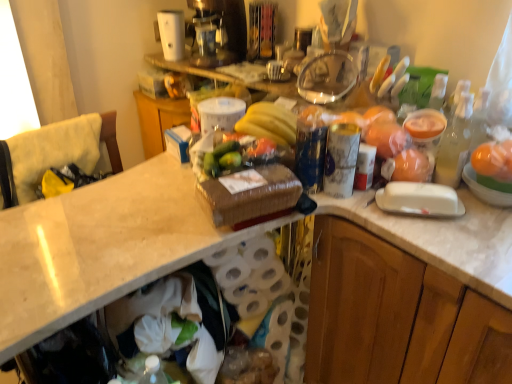
Question: Visually, is yellow fabric cushion at left positioned to the left or to the right of orange matte plastic oranges at upper right?

Choices:
 (A) left
 (B) right

Answer: (A)

Question: Does point (16, 140) appear closer or farther from the camera than point (403, 132)?

Choices:
 (A) farther
 (B) closer

Answer: (A)

Question: Based on their relative distances, which object is nearer to the white plastic coffee maker at upper center?

Choices:
 (A) yellow matte bananas at center
 (B) yellow fabric cushion at left
 (C) wooden cabinet at right
 (D) orange matte plastic oranges at upper right
 (E) translucent glass bottle at right

Answer: (B)

Question: Based on their relative distances, which object is nearer to the white plastic coffee maker at upper center?

Choices:
 (A) orange matte plastic oranges at upper right
 (B) yellow fabric cushion at left
 (C) translucent glass bottle at right
 (D) yellow matte bananas at center
 (E) wooden cabinet at right

Answer: (B)